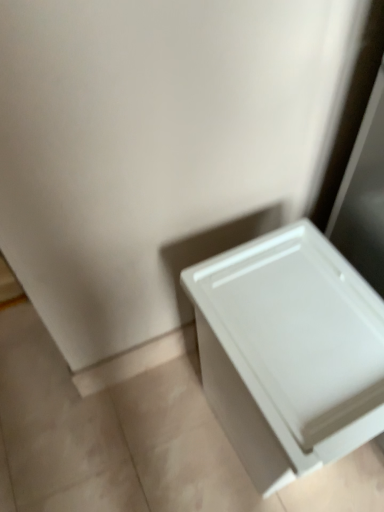
The image size is (384, 512). What do you see at coordinates (289, 352) in the screenshot?
I see `white plastic toilet at lower right` at bounding box center [289, 352].

Locate an element on the screen. white plastic toilet at lower right is located at coordinates (289, 352).

The width and height of the screenshot is (384, 512). In order to click on white plastic toilet at lower right in this screenshot , I will do `click(289, 352)`.